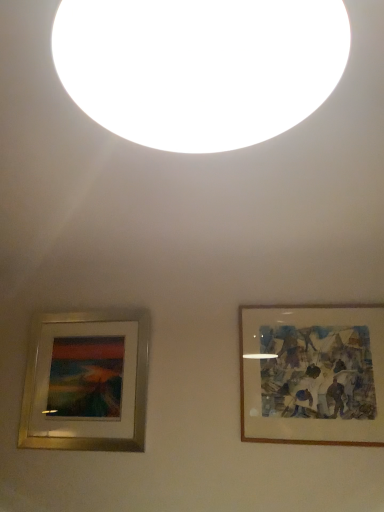
What do you see at coordinates (312, 374) in the screenshot? The image size is (384, 512). I see `wooden frame at right, the first picture frame in the right-to-left sequence` at bounding box center [312, 374].

How much space does wooden frame at right, which appears as the 2th picture frame when viewed from the left, occupy vertically?

The height of wooden frame at right, which appears as the 2th picture frame when viewed from the left, is 76.64 centimeters.

Where is `wooden frame at right, which appears as the 2th picture frame when viewed from the left`? wooden frame at right, which appears as the 2th picture frame when viewed from the left is located at coordinates (312, 374).

Does wooden frame at right, which appears as the 2th picture frame when viewed from the left, have a larger size compared to white matte light at upper center?

Incorrect, wooden frame at right, which appears as the 2th picture frame when viewed from the left, is not larger than white matte light at upper center.

Is wooden frame at right, the first picture frame in the right-to-left sequence, looking in the opposite direction of white matte light at upper center?

No, wooden frame at right, the first picture frame in the right-to-left sequence, is not facing the opposite direction of white matte light at upper center.

In the scene shown: In the image, is wooden frame at right, the first picture frame in the right-to-left sequence, on the left side or the right side of white matte light at upper center?

In the image, wooden frame at right, the first picture frame in the right-to-left sequence, appears on the right side of white matte light at upper center.

How much distance is there between white matte light at upper center and wooden frame at right, which appears as the 2th picture frame when viewed from the left?

white matte light at upper center is 1.92 meters away from wooden frame at right, which appears as the 2th picture frame when viewed from the left.

From the picture: Considering the positions of objects white matte light at upper center and wooden frame at right, which appears as the 2th picture frame when viewed from the left, in the image provided, who is more to the right, white matte light at upper center or wooden frame at right, which appears as the 2th picture frame when viewed from the left,?

wooden frame at right, which appears as the 2th picture frame when viewed from the left, is more to the right.

What's the angular difference between white matte light at upper center and wooden frame at right, which appears as the 2th picture frame when viewed from the left,'s facing directions?

90 degrees separate the facing orientations of white matte light at upper center and wooden frame at right, which appears as the 2th picture frame when viewed from the left.

Is point (317, 16) behind point (270, 354)?

No, it is in front of (270, 354).

Is gold metallic picture frame at lower left, which appears as the 1th picture frame when viewed from the left, facing towards white matte light at upper center?

Yes, gold metallic picture frame at lower left, which appears as the 1th picture frame when viewed from the left, is turned towards white matte light at upper center.

Considering the sizes of gold metallic picture frame at lower left, the second picture frame positioned from the right, and white matte light at upper center in the image, is gold metallic picture frame at lower left, the second picture frame positioned from the right, wider or thinner than white matte light at upper center?

gold metallic picture frame at lower left, the second picture frame positioned from the right, is thinner than white matte light at upper center.

Visually, is gold metallic picture frame at lower left, the second picture frame positioned from the right, positioned to the left or to the right of white matte light at upper center?

gold metallic picture frame at lower left, the second picture frame positioned from the right, is positioned on white matte light at upper center's left side.

Can you tell me how much gold metallic picture frame at lower left, which appears as the 1th picture frame when viewed from the left, and white matte light at upper center differ in facing direction?

The angle between the facing direction of gold metallic picture frame at lower left, which appears as the 1th picture frame when viewed from the left, and the facing direction of white matte light at upper center is 90 degrees.

Is white matte light at upper center oriented towards gold metallic picture frame at lower left, which appears as the 1th picture frame when viewed from the left?

No, white matte light at upper center is not aimed at gold metallic picture frame at lower left, which appears as the 1th picture frame when viewed from the left.

Which of these two, white matte light at upper center or gold metallic picture frame at lower left, the second picture frame positioned from the right, is smaller?

gold metallic picture frame at lower left, the second picture frame positioned from the right, is smaller.

From a real-world perspective, is white matte light at upper center above or below gold metallic picture frame at lower left, the second picture frame positioned from the right?

white matte light at upper center is above gold metallic picture frame at lower left, the second picture frame positioned from the right.

Between white matte light at upper center and gold metallic picture frame at lower left, the second picture frame positioned from the right, which one has larger width?

white matte light at upper center is wider.

Is gold metallic picture frame at lower left, which appears as the 1th picture frame when viewed from the left, thinner than wooden frame at right, the first picture frame in the right-to-left sequence?

In fact, gold metallic picture frame at lower left, which appears as the 1th picture frame when viewed from the left, might be wider than wooden frame at right, the first picture frame in the right-to-left sequence.

Considering their positions, is gold metallic picture frame at lower left, the second picture frame positioned from the right, located in front of or behind wooden frame at right, the first picture frame in the right-to-left sequence?

Clearly, gold metallic picture frame at lower left, the second picture frame positioned from the right, is behind wooden frame at right, the first picture frame in the right-to-left sequence.

Can you confirm if gold metallic picture frame at lower left, which appears as the 1th picture frame when viewed from the left, is positioned to the right of wooden frame at right, which appears as the 2th picture frame when viewed from the left?

No.

From the image's perspective, would you say gold metallic picture frame at lower left, which appears as the 1th picture frame when viewed from the left, is positioned over wooden frame at right, the first picture frame in the right-to-left sequence?

No, from the image's perspective, gold metallic picture frame at lower left, which appears as the 1th picture frame when viewed from the left, is not on top of wooden frame at right, the first picture frame in the right-to-left sequence.

From the image's perspective, which is above, wooden frame at right, which appears as the 2th picture frame when viewed from the left, or gold metallic picture frame at lower left, the second picture frame positioned from the right?

wooden frame at right, which appears as the 2th picture frame when viewed from the left, is shown above in the image.

Is gold metallic picture frame at lower left, which appears as the 1th picture frame when viewed from the left, surrounded by wooden frame at right, which appears as the 2th picture frame when viewed from the left?

Definitely not — gold metallic picture frame at lower left, which appears as the 1th picture frame when viewed from the left, is not inside wooden frame at right, which appears as the 2th picture frame when viewed from the left.

Is wooden frame at right, the first picture frame in the right-to-left sequence, taller than gold metallic picture frame at lower left, which appears as the 1th picture frame when viewed from the left?

Incorrect, the height of wooden frame at right, the first picture frame in the right-to-left sequence, is not larger of that of gold metallic picture frame at lower left, which appears as the 1th picture frame when viewed from the left.

Locate an element on the screen. The width and height of the screenshot is (384, 512). picture frame positioned vertically above the gold metallic picture frame at lower left, which appears as the 1th picture frame when viewed from the left (from a real-world perspective) is located at coordinates (312, 374).

This screenshot has width=384, height=512. Identify the location of lighting that is above the wooden frame at right, which appears as the 2th picture frame when viewed from the left (from the image's perspective). (200, 67).

Identify the location of lighting located on the left of wooden frame at right, the first picture frame in the right-to-left sequence. The width and height of the screenshot is (384, 512). (x=200, y=67).

Estimate the real-world distances between objects in this image. Which object is closer to white matte light at upper center, wooden frame at right, which appears as the 2th picture frame when viewed from the left, or gold metallic picture frame at lower left, which appears as the 1th picture frame when viewed from the left?

wooden frame at right, which appears as the 2th picture frame when viewed from the left, lies closer to white matte light at upper center than the other object.

Considering their positions, is gold metallic picture frame at lower left, the second picture frame positioned from the right, positioned closer to white matte light at upper center than wooden frame at right, which appears as the 2th picture frame when viewed from the left?

wooden frame at right, which appears as the 2th picture frame when viewed from the left, lies closer to white matte light at upper center than the other object.

Which object lies nearer to the anchor point gold metallic picture frame at lower left, which appears as the 1th picture frame when viewed from the left, white matte light at upper center or wooden frame at right, which appears as the 2th picture frame when viewed from the left?

wooden frame at right, which appears as the 2th picture frame when viewed from the left.

Considering their positions, is wooden frame at right, the first picture frame in the right-to-left sequence, positioned further to gold metallic picture frame at lower left, which appears as the 1th picture frame when viewed from the left, than white matte light at upper center?

The object further to gold metallic picture frame at lower left, which appears as the 1th picture frame when viewed from the left, is white matte light at upper center.

Estimate the real-world distances between objects in this image. Which object is closer to wooden frame at right, which appears as the 2th picture frame when viewed from the left, white matte light at upper center or gold metallic picture frame at lower left, which appears as the 1th picture frame when viewed from the left?

The object closer to wooden frame at right, which appears as the 2th picture frame when viewed from the left, is gold metallic picture frame at lower left, which appears as the 1th picture frame when viewed from the left.

Which object lies further to the anchor point wooden frame at right, the first picture frame in the right-to-left sequence, gold metallic picture frame at lower left, which appears as the 1th picture frame when viewed from the left, or white matte light at upper center?

white matte light at upper center is positioned further to the anchor wooden frame at right, the first picture frame in the right-to-left sequence.

At what (x,y) coordinates should I click in order to perform the action: click on picture frame located between white matte light at upper center and gold metallic picture frame at lower left, which appears as the 1th picture frame when viewed from the left, in the depth direction. Please return your answer as a coordinate pair (x, y). This screenshot has width=384, height=512. Looking at the image, I should click on (312, 374).